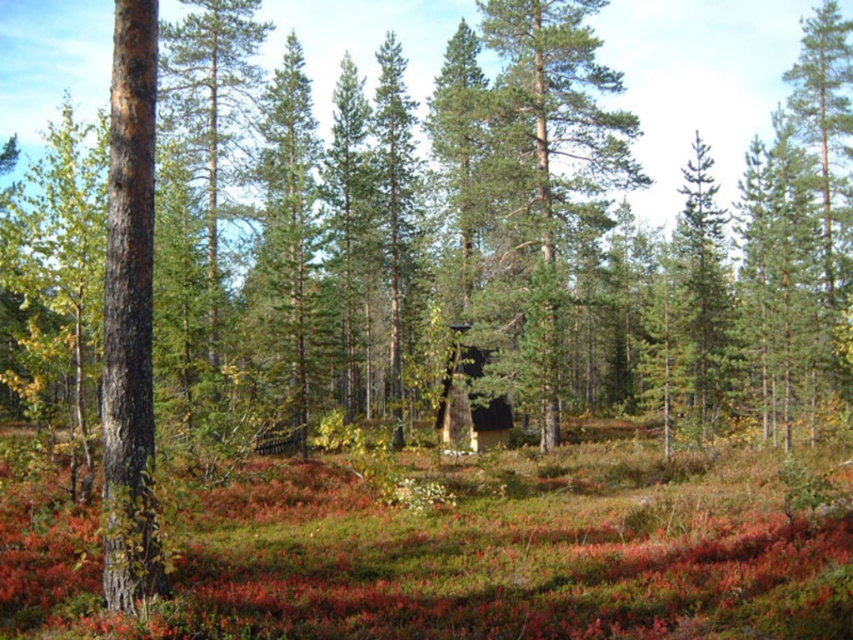
You are navigating through the forest and need to identify the location of the smooth brown bark at left. According to the coordinates provided, where exactly is it positioned in the scene?

The smooth brown bark at left is located at point (131,316), which places it near the lower left quadrant of the scene.